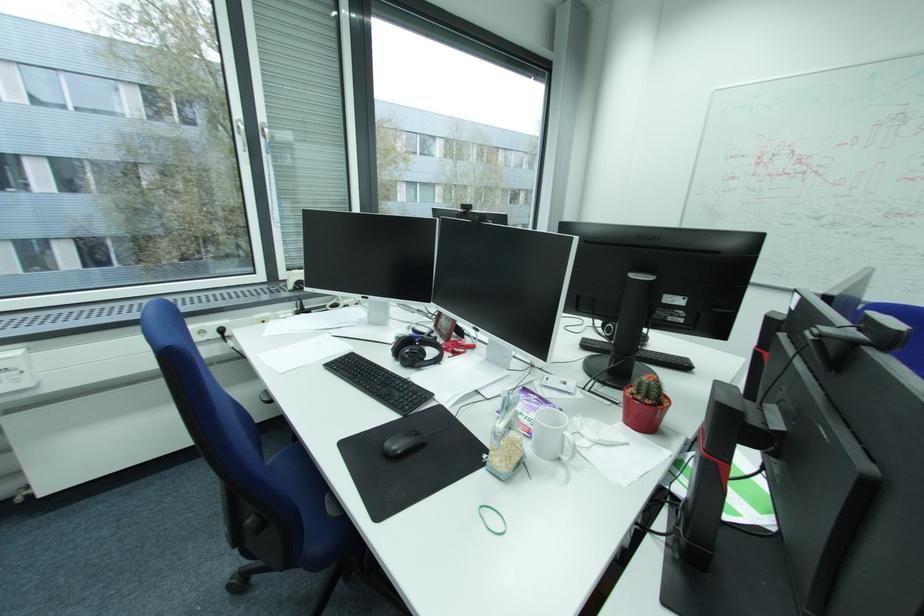
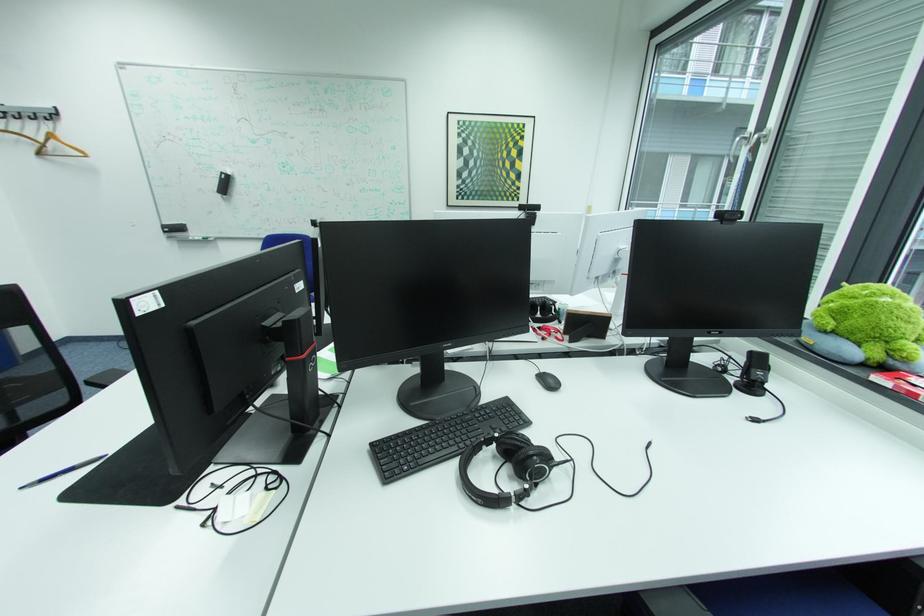
Question: I am providing you with two images of the same scene from different viewpoints. Please identify which objects are invisible in image2.

Choices:
 (A) black computer mouse
 (B) plastic bag of grains
 (C) black keyboard
 (D) red capped bottle

Answer: (B)